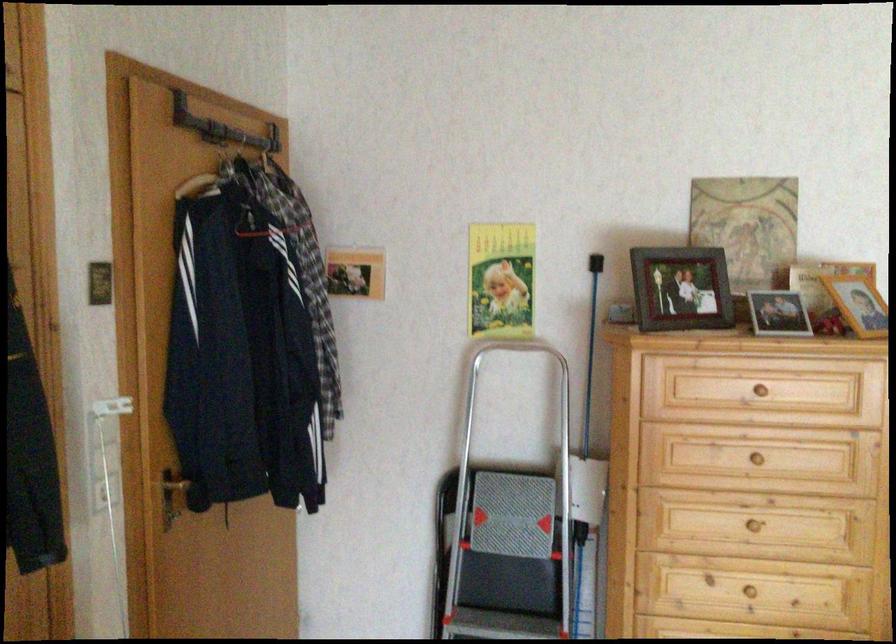
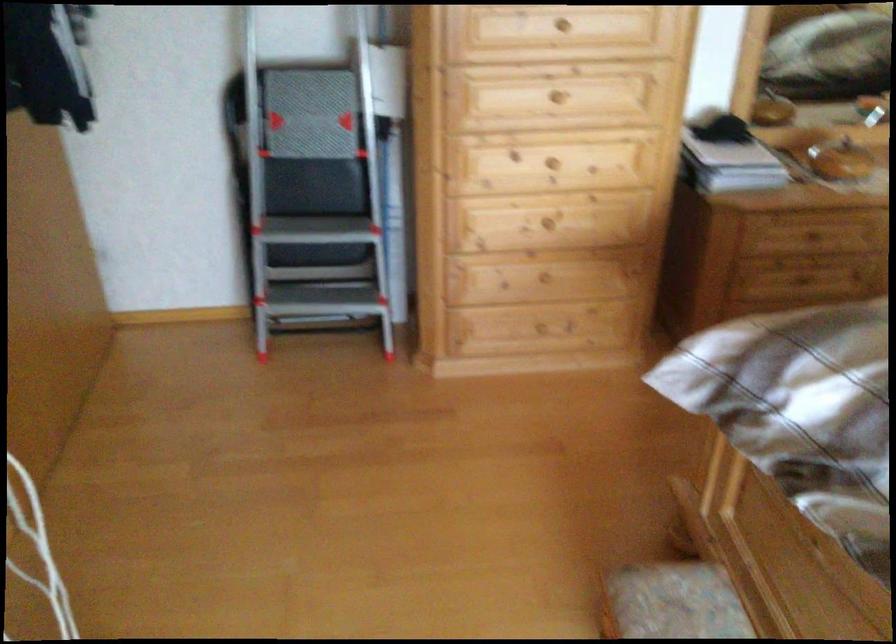
Which direction would the cameraman need to move to produce the second image?

The cameraman moved toward left, forward.